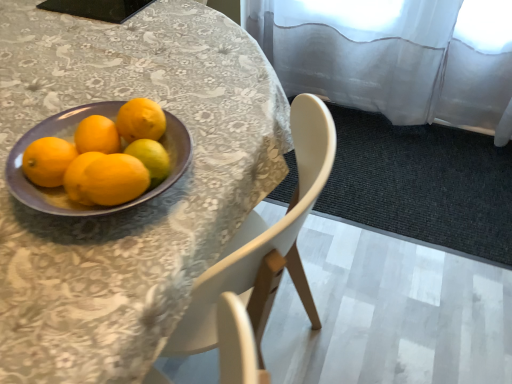
What is the approximate height of yellow matte lemon at center?

It is 1.50 inches.

This screenshot has height=384, width=512. What do you see at coordinates (71, 140) in the screenshot?
I see `purple glossy bowl at left` at bounding box center [71, 140].

What is the approximate width of matte yellow orange at left?

The width of matte yellow orange at left is 2.22 inches.

At what (x,y) coordinates should I click in order to perform the action: click on matte yellow orange at left. Please return your answer as a coordinate pair (x, y). The width and height of the screenshot is (512, 384). Looking at the image, I should click on (48, 161).

Identify the location of yellow matte lemon at center. (151, 158).

Is purple plate at upper left inside the boundaries of matte yellow orange at left, or outside?

purple plate at upper left is outside matte yellow orange at left.

Could you tell me if purple plate at upper left is facing matte yellow orange at left?

No, purple plate at upper left is not facing towards matte yellow orange at left.

Between purple plate at upper left and matte yellow orange at left, which one has larger size?

With larger size is purple plate at upper left.

Which object is closer to the camera, purple plate at upper left or matte yellow orange at left?

purple plate at upper left is more forward.

Considering the sizes of matte yellow orange at left and purple glossy bowl at left in the image, is matte yellow orange at left taller or shorter than purple glossy bowl at left?

Considering their sizes, matte yellow orange at left has less height than purple glossy bowl at left.

From the image's perspective, between matte yellow orange at left and purple glossy bowl at left, which one is located above?

matte yellow orange at left, from the image's perspective.

Considering the positions of objects matte yellow orange at left and purple glossy bowl at left in the image provided, who is in front, matte yellow orange at left or purple glossy bowl at left?

purple glossy bowl at left.

Based on the photo, looking at the image, does matte yellow orange at left seem bigger or smaller compared to purple glossy bowl at left?

Considering their sizes, matte yellow orange at left takes up less space than purple glossy bowl at left.

Between yellow matte lemon at center and purple plate at upper left, which one has smaller width?

With smaller width is yellow matte lemon at center.

Is yellow matte lemon at center far away from purple plate at upper left?

No, yellow matte lemon at center is in close proximity to purple plate at upper left.

Consider the image. From a real-world perspective, which is physically below, yellow matte lemon at center or purple plate at upper left?

purple plate at upper left is physically lower.

Can we say yellow matte lemon at center lies outside purple plate at upper left?

yellow matte lemon at center is positioned outside purple plate at upper left.

Can you confirm if yellow matte lemon at center is smaller than purple glossy bowl at left?

Yes, yellow matte lemon at center is smaller than purple glossy bowl at left.

Considering the relative positions of yellow matte lemon at center and purple glossy bowl at left in the image provided, is yellow matte lemon at center to the left of purple glossy bowl at left from the viewer's perspective?

Incorrect, yellow matte lemon at center is not on the left side of purple glossy bowl at left.

Locate an element on the screen. bowl in front of the yellow matte lemon at center is located at coordinates click(x=71, y=140).

Is yellow matte lemon at center far from purple glossy bowl at left?

No, yellow matte lemon at center is in close proximity to purple glossy bowl at left.

The height and width of the screenshot is (384, 512). I want to click on table in front of the purple glossy bowl at left, so click(x=136, y=206).

Which of these two, purple plate at upper left or purple glossy bowl at left, is wider?

With larger width is purple plate at upper left.

Choose the correct answer: Is purple plate at upper left inside purple glossy bowl at left or outside it?

purple plate at upper left is not inside purple glossy bowl at left, it's outside.

Which is behind, point (150, 144) or point (53, 184)?

The point (150, 144) is farther from the camera.

From a real-world perspective, is yellow matte lemon at center positioned under matte yellow orange at left based on gravity?

Correct, in the physical world, yellow matte lemon at center is lower than matte yellow orange at left.

Considering the relative positions of yellow matte lemon at center and matte yellow orange at left in the image provided, is yellow matte lemon at center in front of matte yellow orange at left?

No, it is behind matte yellow orange at left.

How different are the orientations of yellow matte lemon at center and matte yellow orange at left in degrees?

The angle between the facing direction of yellow matte lemon at center and the facing direction of matte yellow orange at left is 0.0029 degrees.

From a real-world perspective, is purple glossy bowl at left on yellow matte lemon at center?

Incorrect, from a real-world perspective, purple glossy bowl at left is lower than yellow matte lemon at center.

Is purple glossy bowl at left surrounding yellow matte lemon at center?

Yes, purple glossy bowl at left is surrounding yellow matte lemon at center.

In the image, there is a matte yellow orange at left. Where is `table below it (from the image's perspective)`? table below it (from the image's perspective) is located at coordinates (136, 206).

Find the location of a particular element. This screenshot has width=512, height=384. orange above the purple glossy bowl at left (from the image's perspective) is located at coordinates (48, 161).

Considering their positions, is purple glossy bowl at left positioned closer to purple plate at upper left than matte yellow orange at left?

purple glossy bowl at left lies closer to purple plate at upper left than the other object.

Based on their spatial positions, is matte yellow orange at left or yellow matte lemon at center closer to purple glossy bowl at left?

matte yellow orange at left.

From the image, which object appears to be nearer to matte yellow orange at left, yellow matte lemon at center or purple glossy bowl at left?

purple glossy bowl at left.

Considering their positions, is yellow matte lemon at center positioned closer to purple glossy bowl at left than matte yellow orange at left?

The object closer to purple glossy bowl at left is matte yellow orange at left.

Based on their spatial positions, is purple glossy bowl at left or matte yellow orange at left further from yellow matte lemon at center?

matte yellow orange at left.

Consider the image. From the image, which object appears to be nearer to yellow matte lemon at center, purple plate at upper left or purple glossy bowl at left?

purple glossy bowl at left is closer to yellow matte lemon at center.

Based on their spatial positions, is yellow matte lemon at center or purple glossy bowl at left further from purple plate at upper left?

yellow matte lemon at center is further to purple plate at upper left.

Estimate the real-world distances between objects in this image. Which object is closer to matte yellow orange at left, yellow matte lemon at center or purple plate at upper left?

Based on the image, yellow matte lemon at center appears to be nearer to matte yellow orange at left.

You are a GUI agent. You are given a task and a screenshot of the screen. Output one action in this format:
    pyautogui.click(x=<x>, y=<y>)
    Task: Click on the bowl between matte yellow orange at left and purple plate at upper left vertically
    The height and width of the screenshot is (384, 512).
    Given the screenshot: What is the action you would take?
    pyautogui.click(x=71, y=140)

Locate an element on the screen. This screenshot has width=512, height=384. bowl between matte yellow orange at left and yellow matte lemon at center in the horizontal direction is located at coordinates (71, 140).

Where is `bowl between yellow matte lemon at center and purple plate at upper left vertically`? bowl between yellow matte lemon at center and purple plate at upper left vertically is located at coordinates (71, 140).

This screenshot has width=512, height=384. I want to click on orange that lies between yellow matte lemon at center and purple plate at upper left from top to bottom, so click(48, 161).